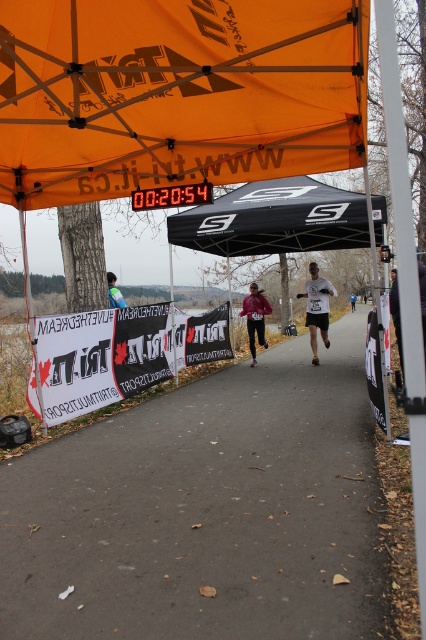
Which is more to the right, gray asphalt road at center or reflective blue vest at center?

From the viewer's perspective, gray asphalt road at center appears more on the right side.

Which is above, gray asphalt road at center or reflective blue vest at center?

reflective blue vest at center

Does point (325, 500) come closer to viewer compared to point (124, 301)?

Yes, it is.

Identify the location of gray asphalt road at center. The image size is (426, 640). (206, 509).

Between point (368, 234) and point (319, 312), which one is positioned in front?

Positioned in front is point (319, 312).

Is black fabric canopy at center smaller than white matte running suit at center?

Incorrect, black fabric canopy at center is not smaller in size than white matte running suit at center.

At what (x,y) coordinates should I click in order to perform the action: click on black fabric canopy at center. Please return your answer as a coordinate pair (x, y). Image resolution: width=426 pixels, height=640 pixels. Looking at the image, I should click on (273, 220).

At what (x,y) coordinates should I click in order to perform the action: click on black fabric canopy at center. Please return your answer as a coordinate pair (x, y). The image size is (426, 640). Looking at the image, I should click on (273, 220).

Does gray asphalt road at center have a greater width compared to orange fabric canopy at upper center?

Correct, the width of gray asphalt road at center exceeds that of orange fabric canopy at upper center.

Is gray asphalt road at center smaller than orange fabric canopy at upper center?

No, gray asphalt road at center is not smaller than orange fabric canopy at upper center.

At what (x,y) coordinates should I click in order to perform the action: click on gray asphalt road at center. Please return your answer as a coordinate pair (x, y). Image resolution: width=426 pixels, height=640 pixels. Looking at the image, I should click on (206, 509).

Where is `gray asphalt road at center`? gray asphalt road at center is located at coordinates tap(206, 509).